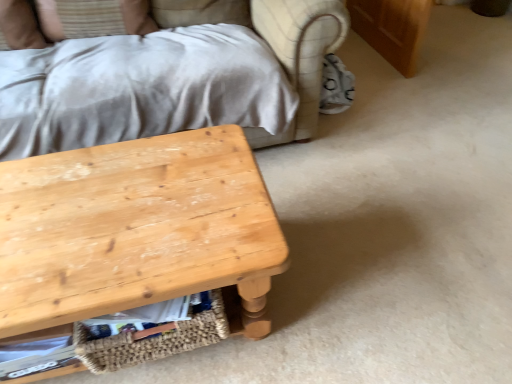
Where is `woven straw basket at lower center`? The image size is (512, 384). woven straw basket at lower center is located at coordinates (152, 340).

Identify the location of white fabric pillow at upper left. (20, 25).

From the image's perspective, is white fabric pillow at upper left located beneath natural wood table at lower left?

Incorrect, from the image's perspective, white fabric pillow at upper left is higher than natural wood table at lower left.

Where is `table in front of the white fabric pillow at upper left`? Image resolution: width=512 pixels, height=384 pixels. table in front of the white fabric pillow at upper left is located at coordinates (136, 230).

Is white fabric pillow at upper left to the right of natural wood table at lower left from the viewer's perspective?

No.

In terms of size, does woven straw basket at lower center appear bigger or smaller than white fabric pillow at upper left?

Considering their sizes, woven straw basket at lower center takes up more space than white fabric pillow at upper left.

Between woven straw basket at lower center and white fabric pillow at upper left, which one has less height?

woven straw basket at lower center.

Is woven straw basket at lower center facing away from white fabric pillow at upper left?

Yes, woven straw basket at lower center's orientation is away from white fabric pillow at upper left.

Where is `basket on the right of the white fabric pillow at upper left`? basket on the right of the white fabric pillow at upper left is located at coordinates (152, 340).

Considering the relative sizes of white fabric pillow at upper left and woven straw basket at lower center in the image provided, is white fabric pillow at upper left taller than woven straw basket at lower center?

Correct, white fabric pillow at upper left is much taller as woven straw basket at lower center.

From a real-world perspective, which is physically above, white fabric pillow at upper left or woven straw basket at lower center?

In real-world perspective, white fabric pillow at upper left is above.

Is white fabric pillow at upper left with woven straw basket at lower center?

No, white fabric pillow at upper left is not touching woven straw basket at lower center.

From the picture: Does white fabric pillow at upper left contain woven straw basket at lower center?

That's incorrect, woven straw basket at lower center is not inside white fabric pillow at upper left.

In terms of size, does natural wood table at lower left appear bigger or smaller than woven straw basket at lower center?

In the image, natural wood table at lower left appears to be larger than woven straw basket at lower center.

Which object is thinner, natural wood table at lower left or woven straw basket at lower center?

With smaller width is woven straw basket at lower center.

Is natural wood table at lower left positioned before woven straw basket at lower center?

Yes, it is.

Considering the sizes of natural wood table at lower left and woven straw basket at lower center in the image, is natural wood table at lower left taller or shorter than woven straw basket at lower center?

Considering their sizes, natural wood table at lower left has more height than woven straw basket at lower center.

Is woven straw basket at lower center next to natural wood table at lower left?

woven straw basket at lower center is not next to natural wood table at lower left, and they're not touching.

Between woven straw basket at lower center and natural wood table at lower left, which one is positioned behind?

Positioned behind is woven straw basket at lower center.

Is woven straw basket at lower center oriented away from natural wood table at lower left?

Yes, woven straw basket at lower center's orientation is away from natural wood table at lower left.

Considering the relative sizes of woven straw basket at lower center and natural wood table at lower left in the image provided, is woven straw basket at lower center wider than natural wood table at lower left?

Result: Incorrect, the width of woven straw basket at lower center does not surpass that of natural wood table at lower left.

Can you confirm if natural wood table at lower left is shorter than white fabric pillow at upper left?

No.

Considering the relative sizes of natural wood table at lower left and white fabric pillow at upper left in the image provided, is natural wood table at lower left thinner than white fabric pillow at upper left?

Incorrect, the width of natural wood table at lower left is not less than that of white fabric pillow at upper left.

What are the coordinates of `pillow above the natural wood table at lower left (from the image's perspective)` in the screenshot? It's located at (20, 25).

The width and height of the screenshot is (512, 384). I want to click on basket located underneath the white fabric pillow at upper left (from a real-world perspective), so click(152, 340).

Based on their spatial positions, is white fabric pillow at upper left or natural wood table at lower left closer to woven straw basket at lower center?

Based on the image, natural wood table at lower left appears to be nearer to woven straw basket at lower center.

From the picture: From the image, which object appears to be farther from white fabric pillow at upper left, natural wood table at lower left or woven straw basket at lower center?

The object further to white fabric pillow at upper left is woven straw basket at lower center.

From the image, which object appears to be nearer to natural wood table at lower left, woven straw basket at lower center or white fabric pillow at upper left?

woven straw basket at lower center lies closer to natural wood table at lower left than the other object.

Based on their spatial positions, is woven straw basket at lower center or natural wood table at lower left further from white fabric pillow at upper left?

Based on the image, woven straw basket at lower center appears to be further to white fabric pillow at upper left.

Based on their spatial positions, is white fabric pillow at upper left or woven straw basket at lower center closer to natural wood table at lower left?

woven straw basket at lower center is closer to natural wood table at lower left.

Based on their spatial positions, is natural wood table at lower left or white fabric pillow at upper left further from woven straw basket at lower center?

white fabric pillow at upper left is positioned further to the anchor woven straw basket at lower center.

At what (x,y) coordinates should I click in order to perform the action: click on table between white fabric pillow at upper left and woven straw basket at lower center in the vertical direction. Please return your answer as a coordinate pair (x, y). Looking at the image, I should click on (136, 230).